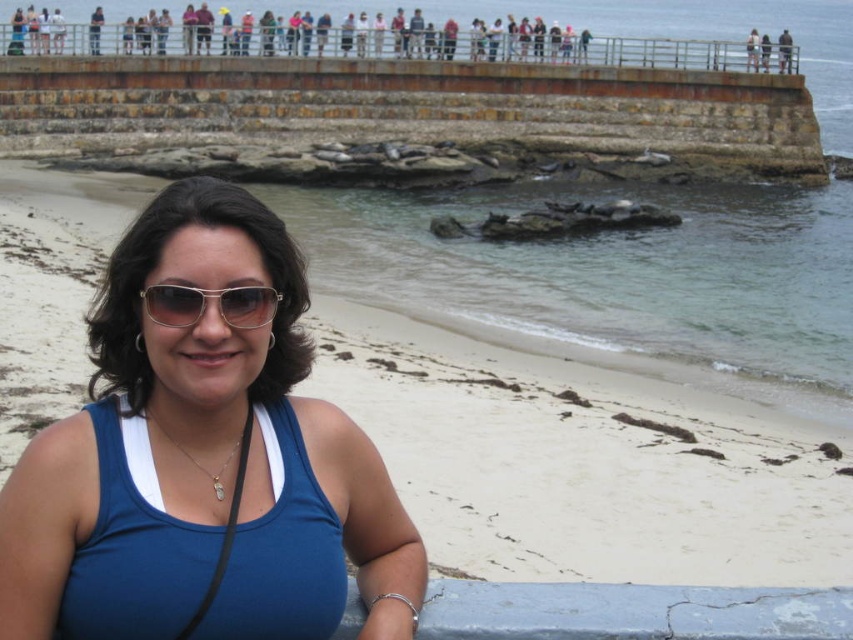
Find the location of a particular element. matte blue tank top at center is located at coordinates (202, 461).

Where is `matte blue tank top at center`? This screenshot has height=640, width=853. matte blue tank top at center is located at coordinates (202, 461).

At what (x,y) coordinates should I click in order to perform the action: click on matte blue tank top at center. Please return your answer as a coordinate pair (x, y). Image resolution: width=853 pixels, height=640 pixels. Looking at the image, I should click on (202, 461).